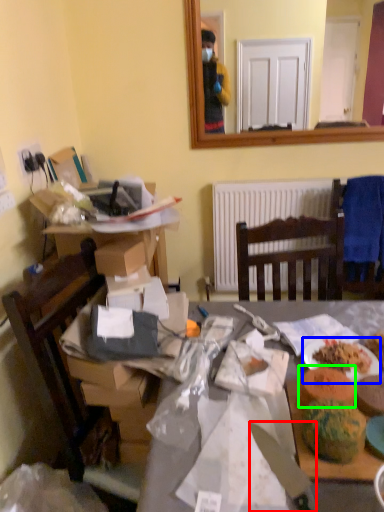
Question: Which object is positioned farthest from knife (highlighted by a red box)? Select from plate (highlighted by a blue box) and food (highlighted by a green box).

Choices:
 (A) plate
 (B) food

Answer: (A)